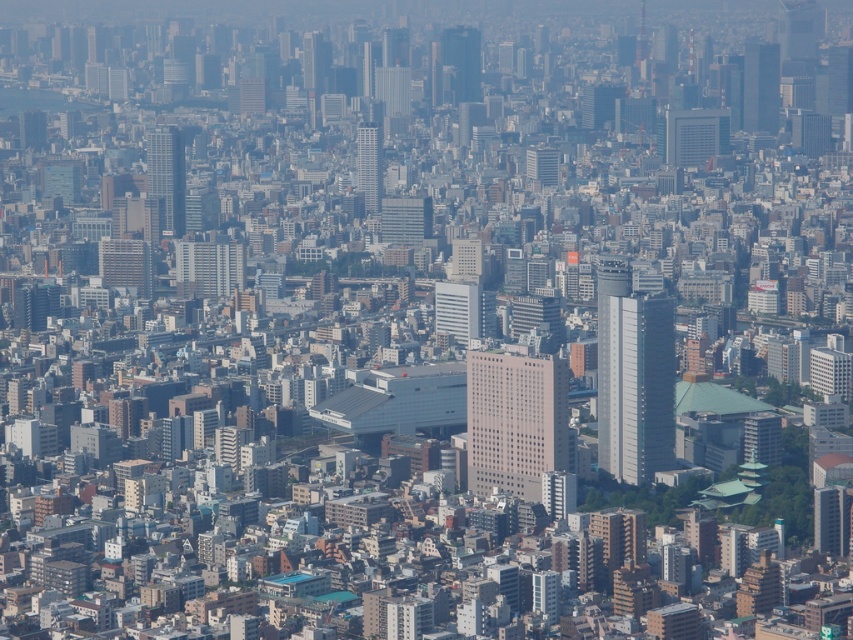
Question: Is beige concrete building at center in front of silver glass skyscraper at center?

Choices:
 (A) no
 (B) yes

Answer: (B)

Question: Which point is closer to the camera taking this photo?

Choices:
 (A) pyautogui.click(x=505, y=470)
 (B) pyautogui.click(x=763, y=70)
 (C) pyautogui.click(x=668, y=112)
 (D) pyautogui.click(x=372, y=157)

Answer: (D)

Question: Can you confirm if beige concrete building at center is thinner than gray concrete skyscraper at upper center?

Choices:
 (A) no
 (B) yes

Answer: (A)

Question: Estimate the real-world distances between objects in this image. Which object is farther from the white glass building at center?

Choices:
 (A) smooth glass skyscraper at upper center
 (B) gray concrete skyscraper at upper center

Answer: (B)

Question: Is silver glass skyscraper at center wider than metallic glass skyscraper at upper center?

Choices:
 (A) yes
 (B) no

Answer: (A)

Question: Which point appears farthest from the camera in this image?

Choices:
 (A) (718, 148)
 (B) (463, 70)
 (C) (672, 298)
 (D) (498, 435)

Answer: (A)